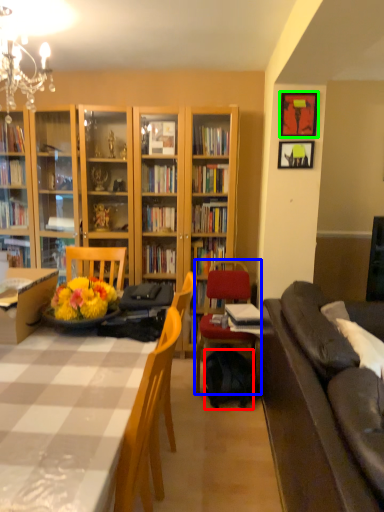
Question: Which is farther away from backpack (highlighted by a red box)? chair (highlighted by a blue box) or picture frame (highlighted by a green box)?

Choices:
 (A) chair
 (B) picture frame

Answer: (B)